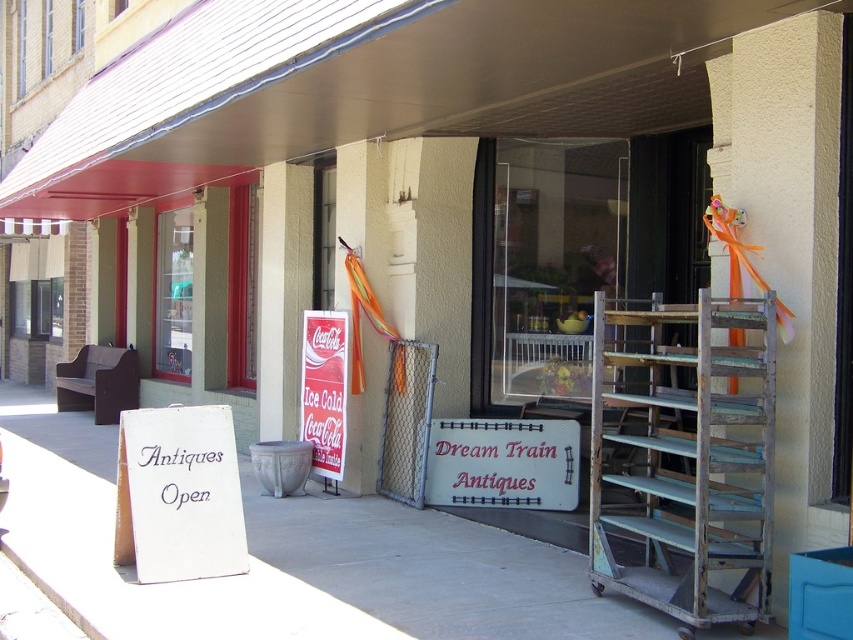
Is point (483, 497) in front of point (323, 422)?

That is True.

Between point (570, 508) and point (338, 451), which one is positioned in front?

Point (570, 508)

Is point (495, 483) farther from viewer compared to point (337, 436)?

No, it is not.

The width and height of the screenshot is (853, 640). I want to click on white wooden sign at center, so click(x=503, y=464).

Between smooth concrete sidewalk at center and white wooden sign at center, which one is positioned lower?

smooth concrete sidewalk at center

Does smooth concrete sidewalk at center appear on the left side of white wooden sign at center?

Correct, you'll find smooth concrete sidewalk at center to the left of white wooden sign at center.

Describe the element at coordinates (437, 572) in the screenshot. I see `smooth concrete sidewalk at center` at that location.

The image size is (853, 640). I want to click on smooth concrete sidewalk at center, so click(x=437, y=572).

Describe the element at coordinates (691, 465) in the screenshot. The image size is (853, 640). I see `rusty metal ladder at right` at that location.

Is rusty metal ladder at right positioned before white wooden sign at center?

Yes.

Where is `rusty metal ladder at right`? Image resolution: width=853 pixels, height=640 pixels. rusty metal ladder at right is located at coordinates (691, 465).